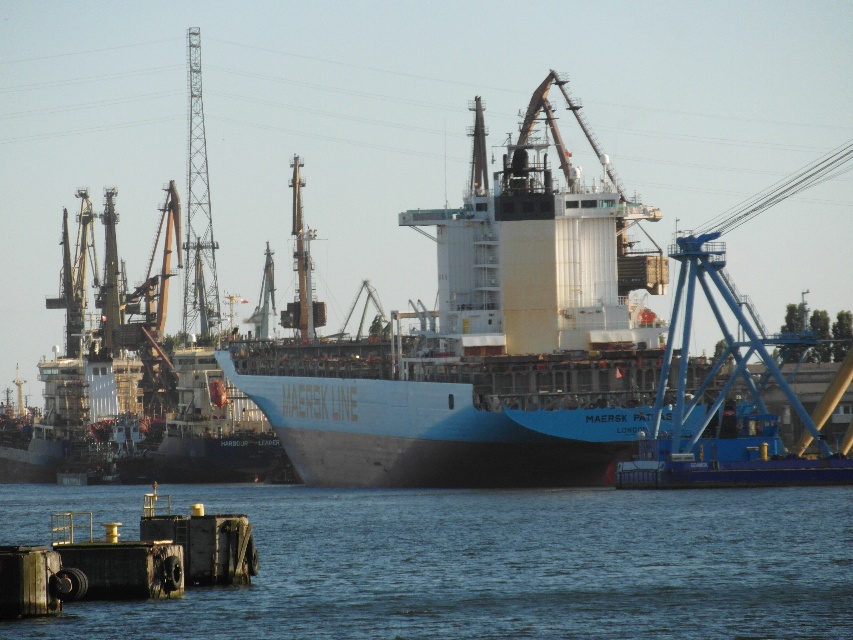
Question: Is the position of blue water at lower left more distant than that of white matte cargo ship at center?

Choices:
 (A) no
 (B) yes

Answer: (A)

Question: Which point appears farthest from the camera in this image?

Choices:
 (A) (328, 627)
 (B) (271, 380)

Answer: (B)

Question: Which of the following is the closest to the observer?

Choices:
 (A) (451, 538)
 (B) (535, 467)

Answer: (A)

Question: Is blue water at lower left below white matte cargo ship at center?

Choices:
 (A) no
 (B) yes

Answer: (B)

Question: Which object appears closest to the camera in this image?

Choices:
 (A) white matte cargo ship at center
 (B) blue water at lower left

Answer: (B)

Question: Does blue water at lower left come behind white matte cargo ship at center?

Choices:
 (A) no
 (B) yes

Answer: (A)